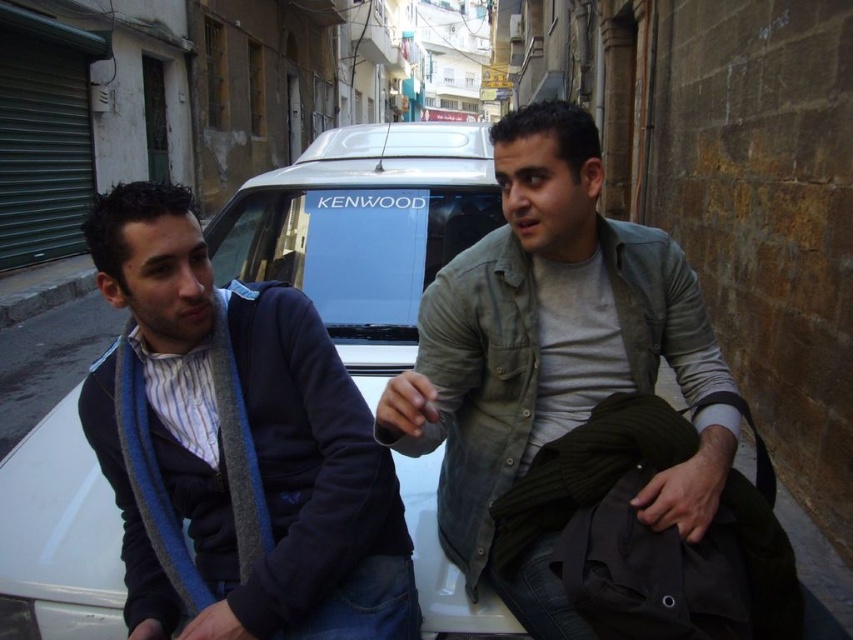
You are a delivery person trying to deliver a package to the gray cotton shirt at center. The white matte car at center is blocking the path. Can you reach the person without moving the car?

The gray cotton shirt at center is positioned under the white matte car at center, so the car is directly blocking the path to the person. You would need to move the car to access the gray cotton shirt at center.

You are a photographer standing in the alleyway and want to take a photo of the gray cotton shirt at center and the white matte car at center. Based on their positions, which object is closer to the right edge of the photo?

The gray cotton shirt at center is positioned on the right side of the white matte car at center, so the gray cotton shirt at center is closer to the right edge of the photo.

You are standing in the alleyway looking at the two people on the vehicle hood. The point at coordinates (538, 344) is on the gray cotton shirt at center. Which person is wearing the gray cotton shirt?

The point at coordinates (538, 344) is on the gray cotton shirt at center, so the person wearing the gray cotton shirt is the one at center.